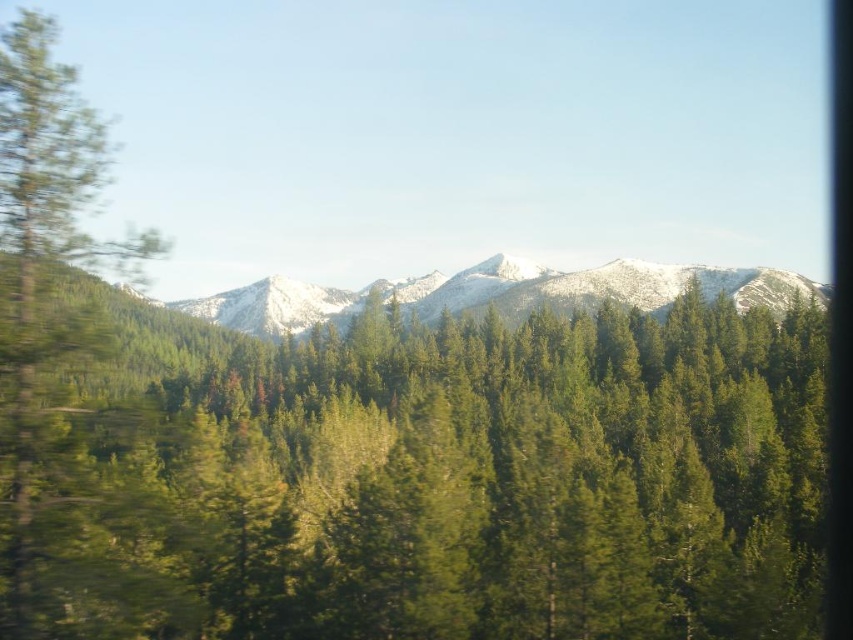
You are standing at the point labeled point (25, 275) and want to walk towards the point labeled point (259, 301). Given that you can only move through areas where the terrain is visible in the image, will you be moving towards or away from the camera as you walk?

You will be moving away from the camera as you walk from point (25, 275) to point (259, 301) because point (25, 275) is closer to the camera than point (259, 301).

You are standing at the center of the forest and want to locate the green matte tree at left. According to the coordinates, where should you look relative to your position?

The green matte tree at left is located at coordinates point [44,312], which means it is positioned to the left and slightly above your current position in the forest.

You are an environmental scientist assessing the biodiversity of this area. Based on the image, which object has a smaller diameter when viewed from above? The green matte tree at left or the snowy mountain range at center?

The green matte tree at left is thinner than the snowy mountain range at center, so the green matte tree at left has a smaller diameter when viewed from above.